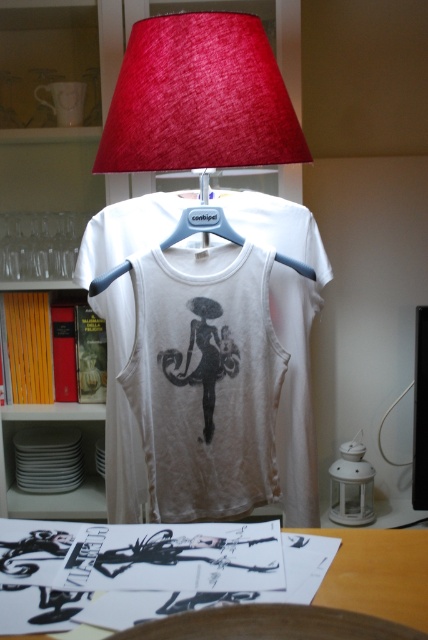
You are trying to determine if the white cotton tank top at center can be placed on the wooden table at lower center without hanging over the edges. Based on the scene, can you confirm if the tank top will fit?

The white cotton tank top at center has a larger size compared to wooden table at lower center, so it will not fit without hanging over the edges.

You are organizing a display and need to place a new item between the yellow wood bookshelf at upper left and the wooden table at lower center. Based on their positions, where should you place the item to ensure it is centered between them?

The yellow wood bookshelf at upper left is positioned on the left side of wooden table at lower center, so placing the item in the middle between them would center it between the two objects.

You are trying to decide whether to take a photo of the white cotton tank top at center from your current position. If you want the subject to fill the frame, would you need to move closer or farther away?

The white cotton tank top at center is 1.31 meters from viewer. To fill the frame, you would need to move closer since the subject is currently at a distance of 1.31 meters.